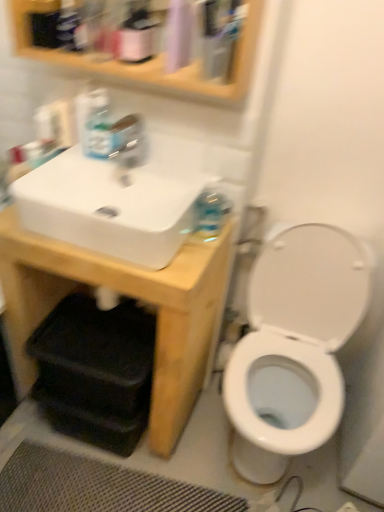
This screenshot has height=512, width=384. What are the coordinates of `unoccupied region to the right of translucent plastic soap dispenser at upper left` in the screenshot? It's located at (159, 166).